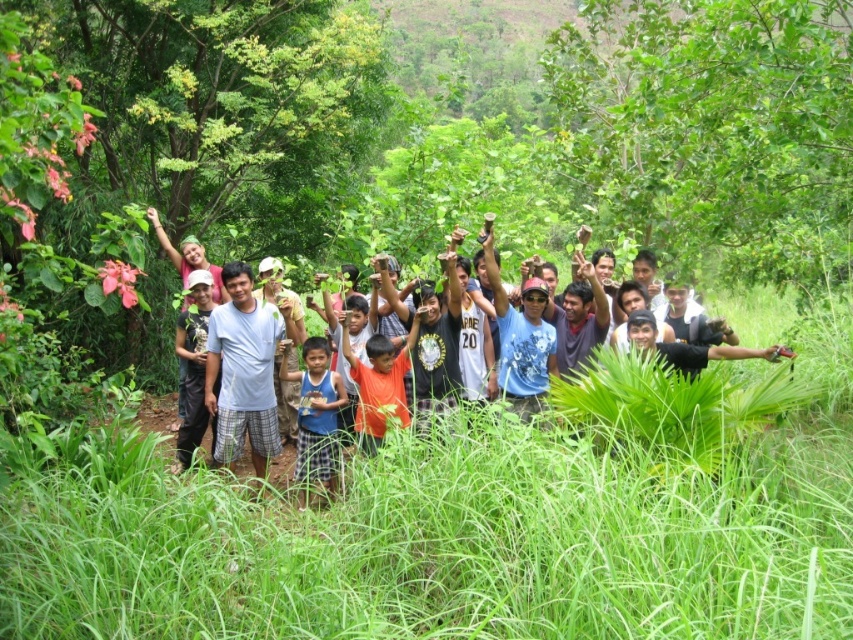
Question: Does blue fabric shirt at center appear on the left side of matte black pants at left?

Choices:
 (A) yes
 (B) no

Answer: (B)

Question: Which object appears closest to the camera in this image?

Choices:
 (A) blue fabric shirt at center
 (B) green leafy tree at center
 (C) matte black pants at left
 (D) orange matte shirt at center

Answer: (B)

Question: Is light blue t-shirt at center to the left of matte black pants at left from the viewer's perspective?

Choices:
 (A) no
 (B) yes

Answer: (A)

Question: Among these objects, which one is farthest from the camera?

Choices:
 (A) matte black pants at left
 (B) light blue t-shirt at center
 (C) orange matte shirt at center

Answer: (A)

Question: Which point is farther from the camera taking this photo?

Choices:
 (A) 329,456
 (B) 361,364

Answer: (A)

Question: Can you confirm if orange matte shirt at center is smaller than matte black pants at left?

Choices:
 (A) yes
 (B) no

Answer: (B)